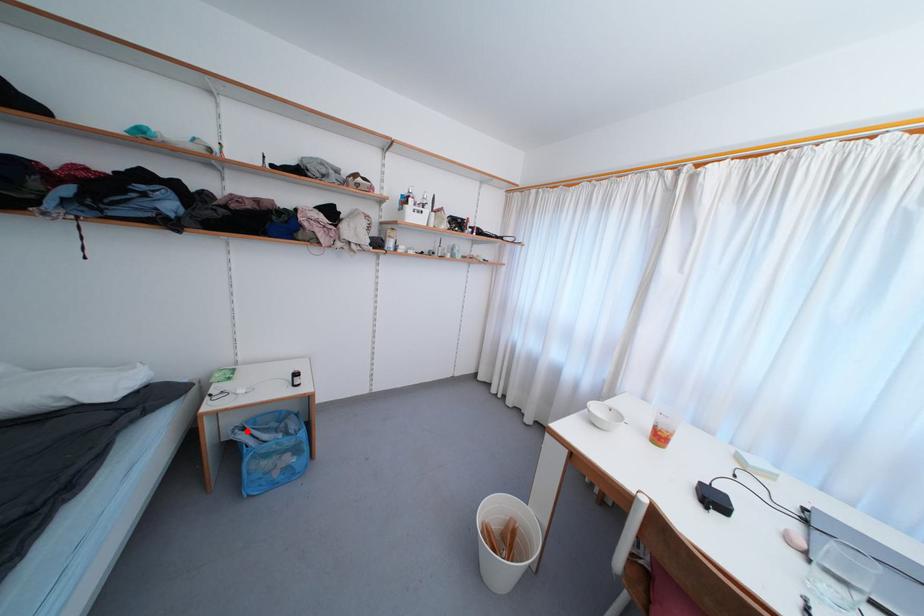
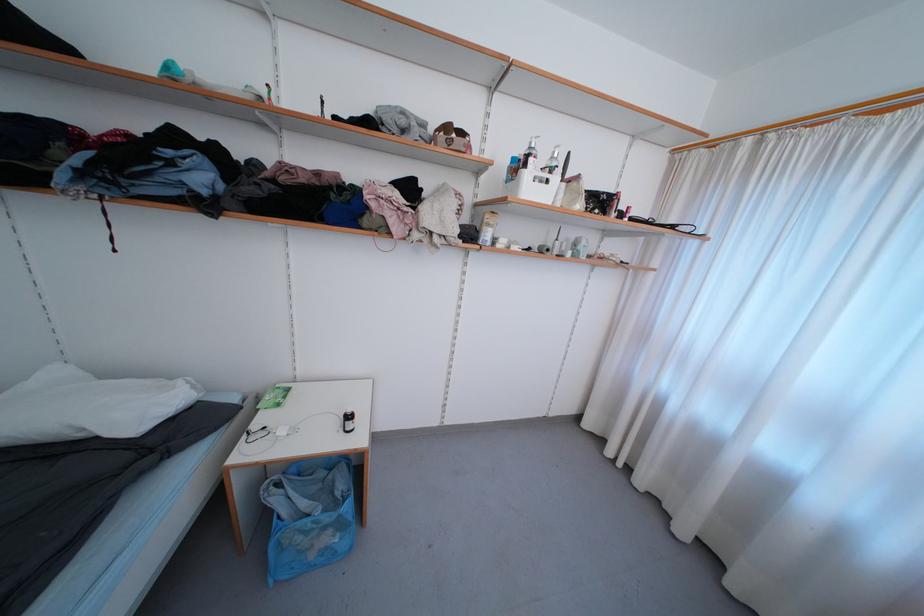
Question: I am providing you with two images of the same scene from different viewpoints. Given a red point in image1, look at the same physical point in image2. Is it:

Choices:
 (A) Closer to the viewpoint
 (B) Farther from the viewpoint

Answer: (B)